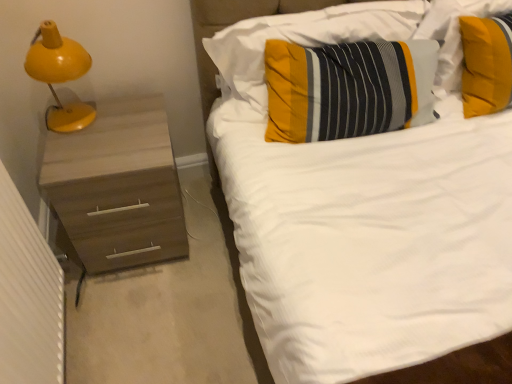
Question: From their relative heights in the image, would you say striped fabric pillow at upper right, which ranks as the 3th pillow in left-to-right order, is taller or shorter than textured yellow pillow at center, which is the second pillow in left-to-right order?

Choices:
 (A) tall
 (B) short

Answer: (A)

Question: Is striped fabric pillow at upper right, arranged as the first pillow when viewed from the right, to the left or to the right of textured yellow pillow at center, which is the second pillow in left-to-right order, in the image?

Choices:
 (A) left
 (B) right

Answer: (B)

Question: Estimate the real-world distances between objects in this image. Which object is closer to the striped fabric pillow at center, the third pillow viewed from the right?

Choices:
 (A) yellow matte lamp at left
 (B) textured yellow pillow at center, the 2th pillow when ordered from right to left
 (C) matte wood chest of drawers at left
 (D) striped fabric pillow at upper right, arranged as the first pillow when viewed from the right

Answer: (B)

Question: Considering the real-world distances, which object is farthest from the matte wood chest of drawers at left?

Choices:
 (A) striped fabric pillow at upper right, arranged as the first pillow when viewed from the right
 (B) yellow matte lamp at left
 (C) textured yellow pillow at center, which is the second pillow in left-to-right order
 (D) striped fabric pillow at center, the third pillow viewed from the right

Answer: (A)